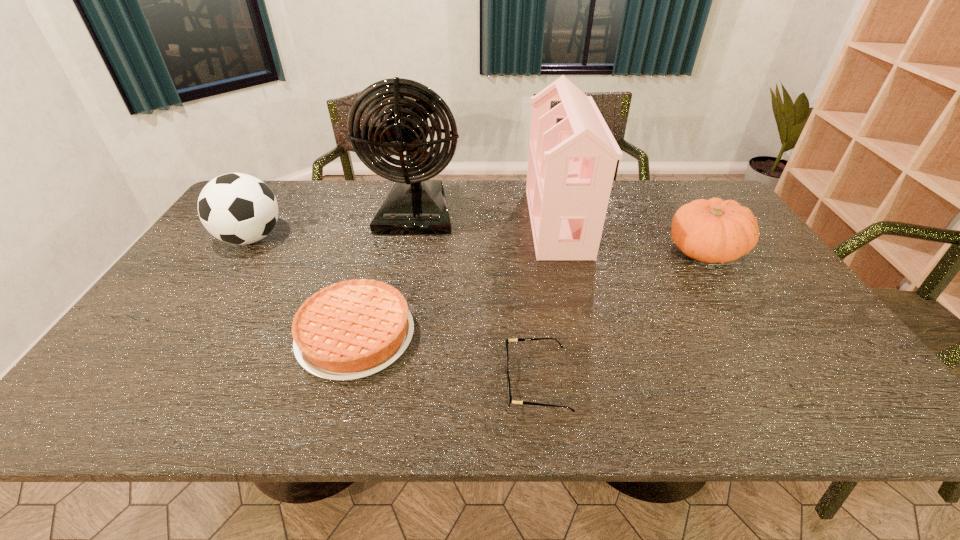
The height and width of the screenshot is (540, 960). What are the coordinates of `pie that is at the near edge` in the screenshot? It's located at (352, 329).

Image resolution: width=960 pixels, height=540 pixels. I want to click on spectacles that is at the near edge, so click(x=518, y=339).

In order to click on object at the left edge in this screenshot , I will do `click(236, 208)`.

At what (x,y) coordinates should I click in order to perform the action: click on object that is positioned at the right edge. Please return your answer as a coordinate pair (x, y). Looking at the image, I should click on (713, 231).

Where is `blank space at the far edge of the desktop`? The width and height of the screenshot is (960, 540). blank space at the far edge of the desktop is located at coordinates (326, 192).

Identify the location of vacant space at the near edge of the desktop. The image size is (960, 540). (697, 402).

Locate an element on the screen. Image resolution: width=960 pixels, height=540 pixels. vacant space at the right edge of the desktop is located at coordinates (767, 286).

The height and width of the screenshot is (540, 960). Find the location of `vacant space at the far left corner of the desktop`. vacant space at the far left corner of the desktop is located at coordinates (287, 194).

Where is `free area in between the fan and the leftmost object`? The width and height of the screenshot is (960, 540). free area in between the fan and the leftmost object is located at coordinates (334, 226).

Identify the location of free spot between the pie and the fifth shortest object. (457, 279).